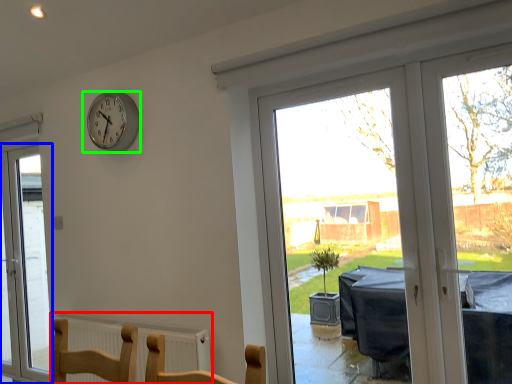
Question: Considering the real-world distances, which object is closest to radiator (highlighted by a red box)? window (highlighted by a blue box) or wall clock (highlighted by a green box).

Choices:
 (A) window
 (B) wall clock

Answer: (B)